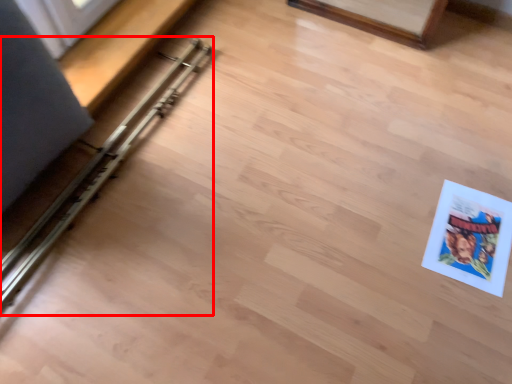
Question: From the image's perspective, where is rail (annotated by the red box) located in relation to comic book in the image?

Choices:
 (A) below
 (B) above

Answer: (B)